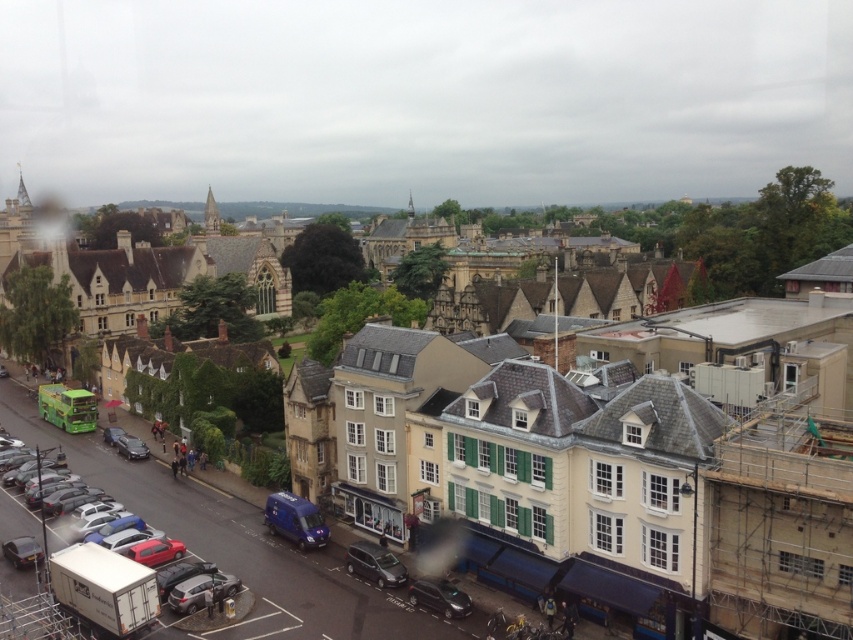
You are standing at the corner of the street and want to locate the metallic silver car at lower center. According to its 2D coordinates, where would you find it?

The metallic silver car at lower center is located at the 2D coordinates point (375,564).

You are standing on a balcony overlooking the street. You notice the matte stone buildings at center and the matte black car at lower left. Which object appears taller from your vantage point?

The matte stone buildings at center appear taller than the matte black car at lower left from your vantage point because the matte stone buildings at center has a greater height compared to matte black car at lower left.

You are standing on the balcony and want to take a photo of both the green double decker bus and the blue van. Which point, point [349,548] or point [131,448], is closer to you and would allow you to frame both vehicles in your shot?

Point [349,548] is closer to the viewer than point [131,448], so it would be the better choice to frame both the green double decker bus and the blue van in your photo.